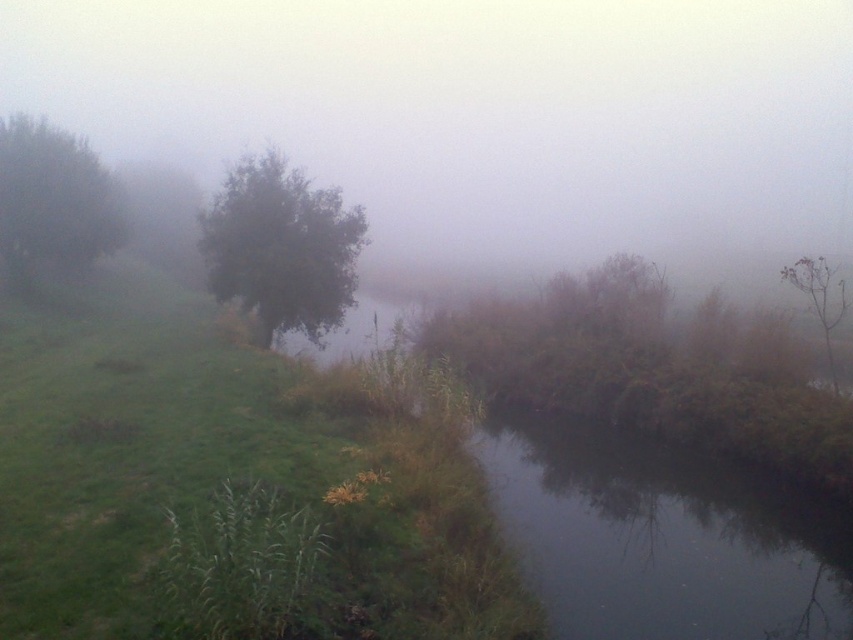
You are an observer standing in the misty landscape. You notice the green leafy tree at center and the brown matte tree at upper right. Which tree is positioned higher in the scene?

The green leafy tree at center is positioned higher than the brown matte tree at upper right.

You are an artist planning to paint this misty landscape. You want to ensure the green leafy tree at center and the brown matte tree at upper right are proportionally accurate. Which tree should you paint larger in your artwork?

The brown matte tree at upper right should be painted larger because it occupies more space than the green leafy tree at center according to the description.

You are standing at the point marked by the coordinates point (281, 248) in the misty landscape. Looking around, you notice a green leafy tree at center. Based on your position, which direction should you walk to reach the green leafy tree at center?

Since you are already at the point representing the green leafy tree at center, you are already at the location of the green leafy tree at center. There is no need to move.